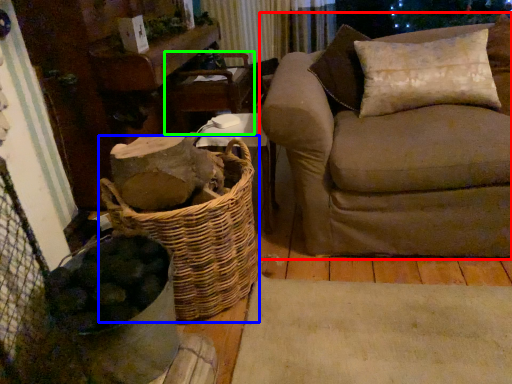
Question: Estimate the real-world distances between objects in this image. Which object is farther from studio couch (highlighted by a red box), basket (highlighted by a blue box) or armchair (highlighted by a green box)?

Choices:
 (A) basket
 (B) armchair

Answer: (B)